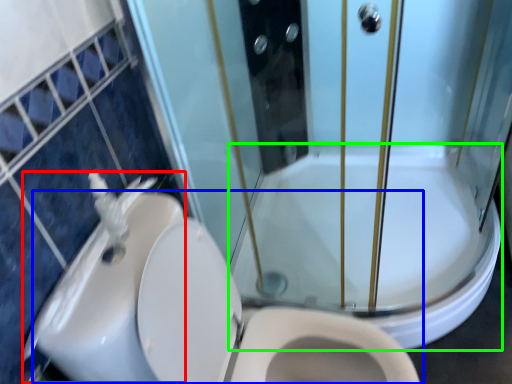
Question: Which is nearer to the sink (highlighted by a red box)? toilet (highlighted by a blue box) or bath (highlighted by a green box).

Choices:
 (A) toilet
 (B) bath

Answer: (A)